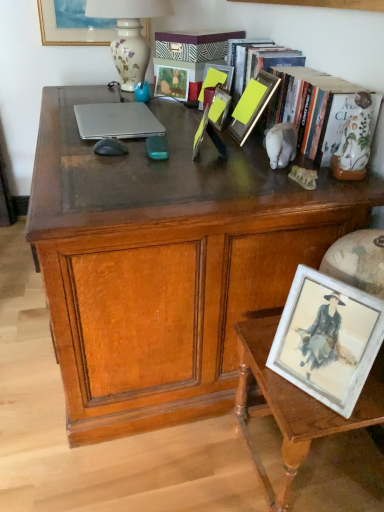
This screenshot has width=384, height=512. In order to click on silver metallic laptop at center in this screenshot , I will do `click(116, 121)`.

Identify the location of wooden desk at center. (166, 263).

The height and width of the screenshot is (512, 384). Describe the element at coordinates (172, 82) in the screenshot. I see `matte wooden picture frame at center, arranged as the 3th picture frame when viewed from the top` at that location.

This screenshot has width=384, height=512. In order to click on hardcover book at upper right in this screenshot , I will do `click(193, 52)`.

Identify the location of transparent plastic mobile phone at center. (157, 147).

Does wooden table at lower right have a smaller size compared to white glossy picture frame at lower right, which appears as the 1th picture frame when ordered from the bottom?

No, wooden table at lower right is not smaller than white glossy picture frame at lower right, which appears as the 1th picture frame when ordered from the bottom.

Is wooden table at lower right oriented away from white glossy picture frame at lower right, marked as the seventh picture frame in a top-to-bottom arrangement?

wooden table at lower right does not have its back to white glossy picture frame at lower right, marked as the seventh picture frame in a top-to-bottom arrangement.

Can you confirm if wooden table at lower right is taller than white glossy picture frame at lower right, which appears as the 1th picture frame when ordered from the bottom?

Indeed, wooden table at lower right has a greater height compared to white glossy picture frame at lower right, which appears as the 1th picture frame when ordered from the bottom.

From the image's perspective, which one is positioned lower, wooden table at lower right or white glossy picture frame at lower right, which appears as the 1th picture frame when ordered from the bottom?

From the image's view, wooden table at lower right is below.

Can you tell me how much porcelain floral lamp at upper center and matte gold picture frame at upper left, which is the first picture frame in back-to-front order, differ in facing direction?

89.3 degrees.

The image size is (384, 512). In order to click on picture frame lying above the porcelain floral lamp at upper center (from the image's perspective) in this screenshot , I will do `click(72, 27)`.

Are porcelain floral lamp at upper center and matte gold picture frame at upper left, which is the seventh picture frame from front to back, beside each other?

porcelain floral lamp at upper center and matte gold picture frame at upper left, which is the seventh picture frame from front to back, are not in contact.

Looking at this image, which of these two, porcelain floral lamp at upper center or matte gold picture frame at upper left, which appears as the 1th picture frame when viewed from the top, is wider?

With larger width is porcelain floral lamp at upper center.

Considering the points (193, 78) and (335, 353), which point is behind, point (193, 78) or point (335, 353)?

The point (193, 78) is farther.

Is matte wooden picture frame at upper center, the sixth picture frame from the bottom, aimed at white glossy picture frame at lower right, which appears as the 1th picture frame when ordered from the bottom?

No, matte wooden picture frame at upper center, the sixth picture frame from the bottom, is not turned towards white glossy picture frame at lower right, which appears as the 1th picture frame when ordered from the bottom.

From a real-world perspective, does matte wooden picture frame at upper center, the sixth picture frame from the bottom, sit lower than white glossy picture frame at lower right, the seventh picture frame positioned from the back?

No, from a real-world perspective, matte wooden picture frame at upper center, the sixth picture frame from the bottom, is not below white glossy picture frame at lower right, the seventh picture frame positioned from the back.

Considering their positions, is matte wooden picture frame at upper center, the sixth picture frame from the bottom, located in front of or behind white glossy picture frame at lower right, the seventh picture frame positioned from the back?

matte wooden picture frame at upper center, the sixth picture frame from the bottom, is behind white glossy picture frame at lower right, the seventh picture frame positioned from the back.

Which object is positioned more to the left, matte wooden picture frame at center, which appears as the 2th picture frame when viewed from the back, or matte glass picture frame at center, which is the fourth picture frame from back to front?

Positioned to the left is matte wooden picture frame at center, which appears as the 2th picture frame when viewed from the back.

Considering the sizes of objects matte wooden picture frame at center, which ranks as the 6th picture frame in front-to-back order, and matte glass picture frame at center, which is the fourth picture frame from back to front, in the image provided, who is shorter, matte wooden picture frame at center, which ranks as the 6th picture frame in front-to-back order, or matte glass picture frame at center, which is the fourth picture frame from back to front,?

With less height is matte wooden picture frame at center, which ranks as the 6th picture frame in front-to-back order.

Between point (188, 82) and point (198, 98), which one is positioned behind?

Positioned behind is point (188, 82).

Where is `picture frame that is the 2nd object to the right of the matte wooden picture frame at center, which appears as the 2th picture frame when viewed from the back, starting at the anchor`? Image resolution: width=384 pixels, height=512 pixels. picture frame that is the 2nd object to the right of the matte wooden picture frame at center, which appears as the 2th picture frame when viewed from the back, starting at the anchor is located at coordinates (216, 79).

Does hardcover book at upper right touch matte wooden picture frame at center, which ranks as the 6th picture frame in front-to-back order?

No, hardcover book at upper right is not next to matte wooden picture frame at center, which ranks as the 6th picture frame in front-to-back order.

In the image, is hardcover book at upper right positioned in front of or behind matte wooden picture frame at center, arranged as the fifth picture frame when ordered from the bottom?

hardcover book at upper right is positioned closer to the viewer than matte wooden picture frame at center, arranged as the fifth picture frame when ordered from the bottom.

Is point (212, 40) behind point (177, 83)?

No.

Looking at this image, considering the sizes of objects hardcover book at upper right and matte wooden picture frame at center, which ranks as the 6th picture frame in front-to-back order, in the image provided, who is shorter, hardcover book at upper right or matte wooden picture frame at center, which ranks as the 6th picture frame in front-to-back order,?

Standing shorter between the two is matte wooden picture frame at center, which ranks as the 6th picture frame in front-to-back order.

What's the angular difference between transparent plastic mobile phone at center and matte glass picture frame at center, the 5th picture frame viewed from the top,'s facing directions?

They differ by 6.68 degrees in their facing directions.

Is transparent plastic mobile phone at center in front of or behind matte glass picture frame at center, which is counted as the 3th picture frame, starting from the front, in the image?

transparent plastic mobile phone at center is positioned closer to the viewer than matte glass picture frame at center, which is counted as the 3th picture frame, starting from the front.

Can you see transparent plastic mobile phone at center touching matte glass picture frame at center, placed as the 5th picture frame when sorted from back to front?

No, transparent plastic mobile phone at center is not next to matte glass picture frame at center, placed as the 5th picture frame when sorted from back to front.

From a real-world perspective, which is physically above, transparent plastic mobile phone at center or matte glass picture frame at center, which is counted as the 3th picture frame, starting from the front?

matte glass picture frame at center, which is counted as the 3th picture frame, starting from the front, is physically above.

Considering the relative sizes of yellow matte picture frame at center, which ranks as the 6th picture frame in top-to-bottom order, and transparent plastic mobile phone at center in the image provided, is yellow matte picture frame at center, which ranks as the 6th picture frame in top-to-bottom order, thinner than transparent plastic mobile phone at center?

No, yellow matte picture frame at center, which ranks as the 6th picture frame in top-to-bottom order, is not thinner than transparent plastic mobile phone at center.

In order to click on mobile phone that appears in front of the yellow matte picture frame at center, placed as the 2th picture frame when sorted from bottom to top in this screenshot , I will do `click(157, 147)`.

Who is taller, yellow matte picture frame at center, which is counted as the 6th picture frame, starting from the back, or transparent plastic mobile phone at center?

yellow matte picture frame at center, which is counted as the 6th picture frame, starting from the back, is taller.

Is yellow matte picture frame at center, which is counted as the 6th picture frame, starting from the back, touching transparent plastic mobile phone at center?

yellow matte picture frame at center, which is counted as the 6th picture frame, starting from the back, and transparent plastic mobile phone at center are clearly separated.

You are a GUI agent. You are given a task and a screenshot of the screen. Output one action in this format:
    pyautogui.click(x=<x>, y=<y>)
    Task: Click on the 1st picture frame counting from the left of the wooden table at lower right
    This screenshot has width=384, height=512.
    Given the screenshot: What is the action you would take?
    pyautogui.click(x=327, y=339)

Locate an element on the screen. The height and width of the screenshot is (512, 384). picture frame that is above the porcelain floral lamp at upper center (from the image's perspective) is located at coordinates (72, 27).

From the image, which object appears to be nearer to wooden table at lower right, silver metallic laptop at center or porcelain floral lamp at upper center?

silver metallic laptop at center is positioned closer to the anchor wooden table at lower right.

Based on their spatial positions, is silver metallic laptop at center or matte wooden picture frame at center, arranged as the fifth picture frame when ordered from the bottom, closer to wooden desk at center?

The object closer to wooden desk at center is silver metallic laptop at center.

When comparing their distances from yellow matte picture frame at center, the second picture frame in the front-to-back sequence, does hardcover book at upper right or matte gold picture frame at upper left, which appears as the 1th picture frame when viewed from the top, seem closer?

The object closer to yellow matte picture frame at center, the second picture frame in the front-to-back sequence, is hardcover book at upper right.

Based on their spatial positions, is transparent plastic mobile phone at center or matte wooden picture frame at center, arranged as the 3th picture frame when viewed from the top, closer to matte gold picture frame at upper left, which is the seventh picture frame from front to back?

matte wooden picture frame at center, arranged as the 3th picture frame when viewed from the top, is positioned closer to the anchor matte gold picture frame at upper left, which is the seventh picture frame from front to back.

Which object lies further to the anchor point matte wooden picture frame at center, arranged as the 3th picture frame when viewed from the top, silver metallic laptop at center or wooden table at lower right?

wooden table at lower right is positioned further to the anchor matte wooden picture frame at center, arranged as the 3th picture frame when viewed from the top.

Estimate the real-world distances between objects in this image. Which object is closer to silver metallic laptop at center, wooden table at lower right or matte glass picture frame at center, which is the fourth picture frame from front to back?

Among the two, matte glass picture frame at center, which is the fourth picture frame from front to back, is located nearer to silver metallic laptop at center.

Based on the photo, from the image, which object appears to be farther from transparent plastic mobile phone at center, hardcover book at upper right or matte glass picture frame at center, which is the fourth picture frame from back to front?

hardcover book at upper right lies further to transparent plastic mobile phone at center than the other object.

Estimate the real-world distances between objects in this image. Which object is closer to wooden desk at center, porcelain floral lamp at upper center or white glossy picture frame at lower right, which appears as the 1th picture frame when ordered from the bottom?

Based on the image, white glossy picture frame at lower right, which appears as the 1th picture frame when ordered from the bottom, appears to be nearer to wooden desk at center.

Locate an element on the screen. The width and height of the screenshot is (384, 512). mobile phone between matte wooden picture frame at upper center, positioned as the 2th picture frame in top-to-bottom order, and white glossy picture frame at lower right, the seventh picture frame positioned from the back, in the up-down direction is located at coordinates (157, 147).

You are a GUI agent. You are given a task and a screenshot of the screen. Output one action in this format:
    pyautogui.click(x=<x>, y=<y>)
    Task: Click on the desk between silver metallic laptop at center and hardcover book at upper right in the horizontal direction
    This screenshot has height=512, width=384.
    Given the screenshot: What is the action you would take?
    pyautogui.click(x=166, y=263)

Where is `desk between silver metallic laptop at center and wooden table at lower right from top to bottom`? desk between silver metallic laptop at center and wooden table at lower right from top to bottom is located at coordinates (166, 263).

The image size is (384, 512). I want to click on book between wooden desk at center and matte glass picture frame at center, placed as the 5th picture frame when sorted from back to front, along the z-axis, so click(193, 52).